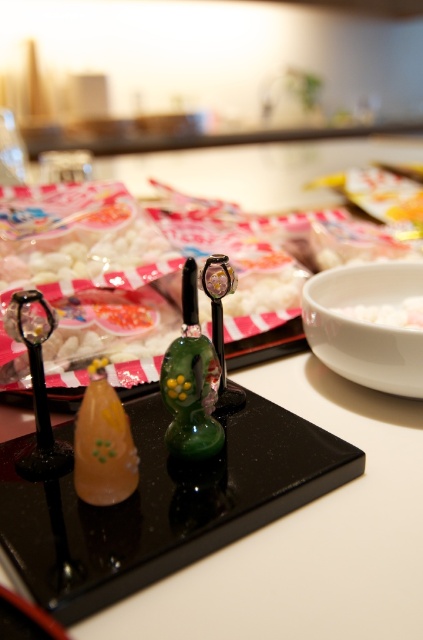
Question: Can you confirm if green glass figurine at center is positioned to the right of translucent orange glass at left?

Choices:
 (A) yes
 (B) no

Answer: (A)

Question: Which point is closer to the camera?

Choices:
 (A) white matte rice at center
 (B) translucent orange glass at left

Answer: (B)

Question: Which of the following is the closest to the observer?

Choices:
 (A) green glass figurine at center
 (B) white matte rice at center

Answer: (A)

Question: Which point is closer to the camera?

Choices:
 (A) (216, 394)
 (B) (82, 465)
 (C) (411, 326)

Answer: (B)

Question: Observing the image, what is the correct spatial positioning of green glass figurine at center in reference to white matte rice at center?

Choices:
 (A) above
 (B) below

Answer: (B)

Question: Can you confirm if translucent orange glass at left is bigger than white matte rice at center?

Choices:
 (A) no
 (B) yes

Answer: (B)